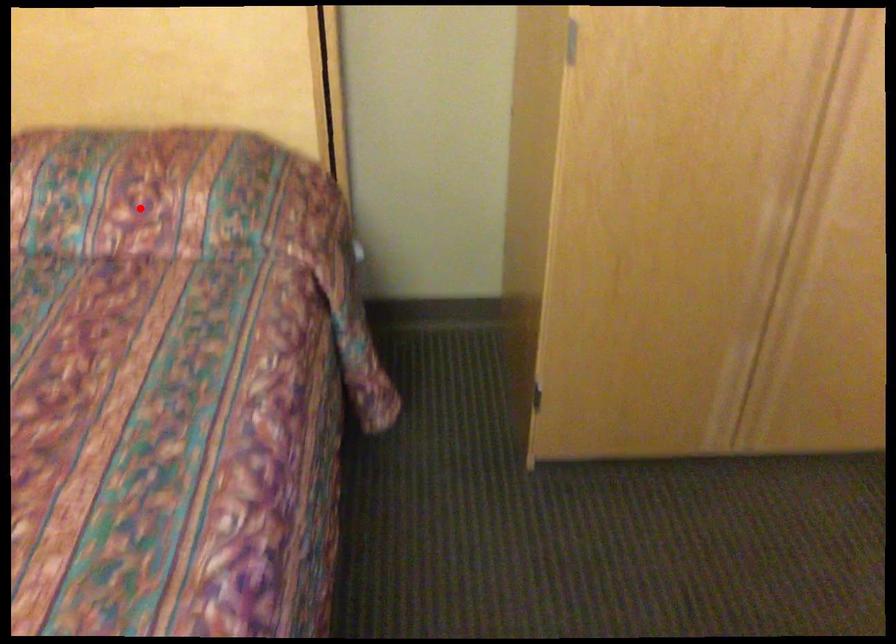
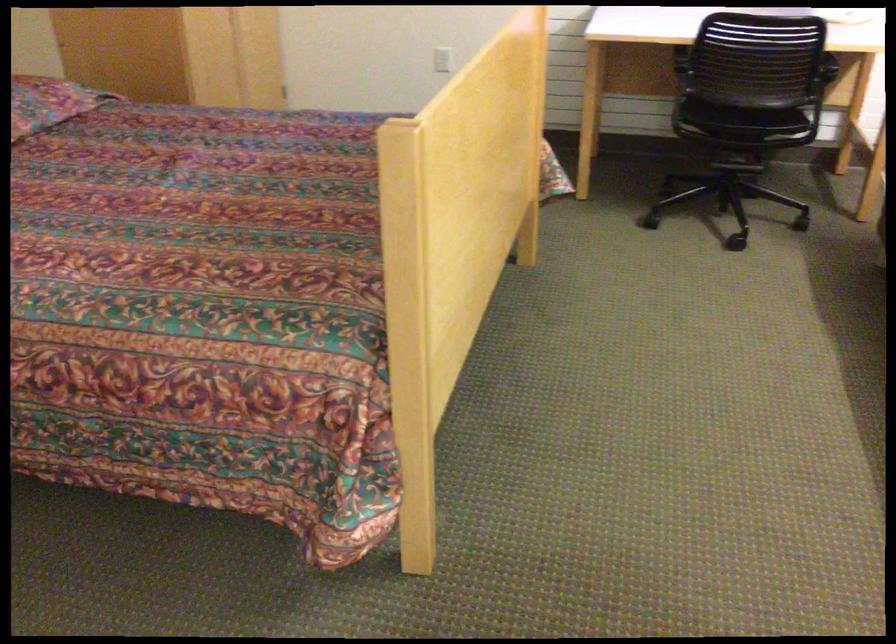
Question: I am providing you with two images of the same scene from different viewpoints. A red point is shown in image1. For the corresponding object point in image2, is it positioned nearer or farther from the camera?

Choices:
 (A) Nearer
 (B) Farther

Answer: (B)